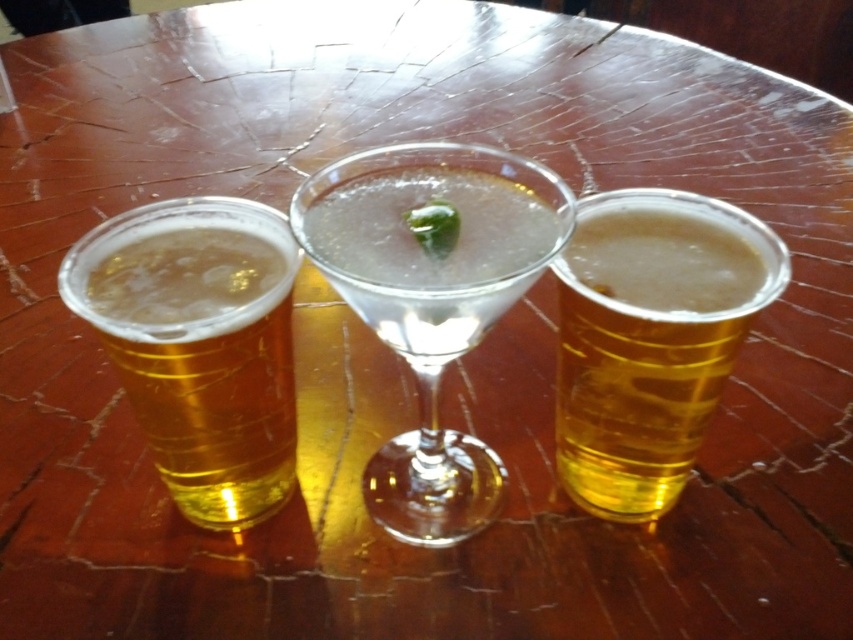
Question: Is translucent plastic cup at left wider than translucent plastic cup at right?

Choices:
 (A) no
 (B) yes

Answer: (B)

Question: Which of the following is the closest to the observer?

Choices:
 (A) clear glass martini at center
 (B) translucent plastic cup at right

Answer: (A)

Question: Which object appears farthest from the camera in this image?

Choices:
 (A) clear glass martini at center
 (B) translucent plastic cup at left
 (C) translucent plastic cup at right

Answer: (C)

Question: Is the position of translucent plastic cup at left more distant than that of translucent plastic cup at right?

Choices:
 (A) yes
 (B) no

Answer: (B)

Question: Which point is farther from the camera taking this photo?

Choices:
 (A) (x=393, y=312)
 (B) (x=173, y=410)

Answer: (B)

Question: Is translucent plastic cup at left closer to camera compared to translucent plastic cup at right?

Choices:
 (A) no
 (B) yes

Answer: (B)